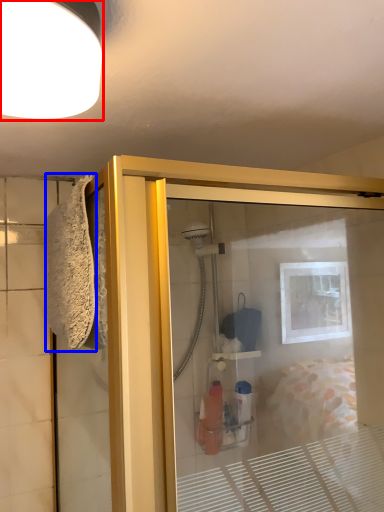
Question: Among these objects, which one is farthest to the camera, light fixture (highlighted by a red box) or bath towel (highlighted by a blue box)?

Choices:
 (A) light fixture
 (B) bath towel

Answer: (B)